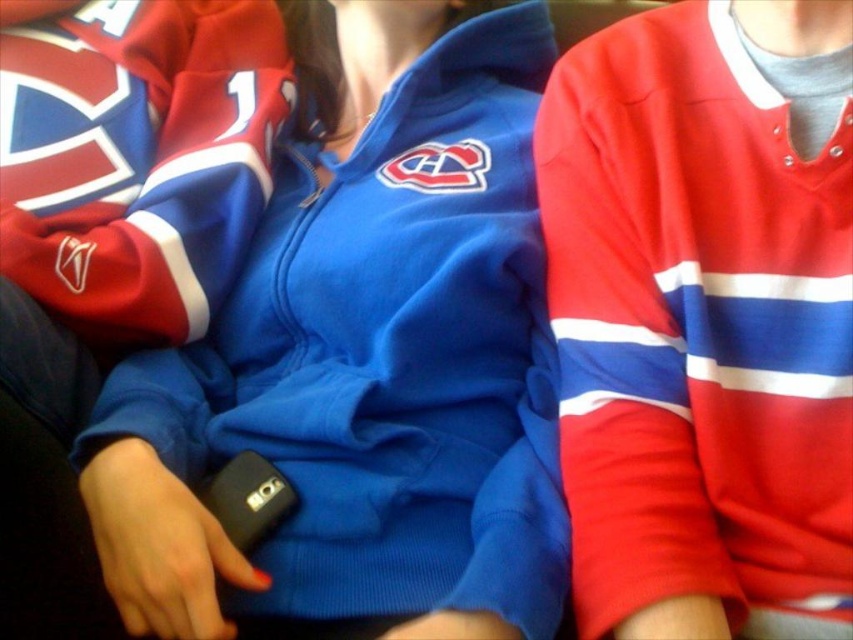
Does matte blue hoodie at center lie behind matte jersey at center?

Yes, it is behind matte jersey at center.

From the picture: Who is higher up, matte blue hoodie at center or matte jersey at center?

matte blue hoodie at center

Is point (347, 394) less distant than point (697, 545)?

No, (347, 394) is behind (697, 545).

Image resolution: width=853 pixels, height=640 pixels. I want to click on matte blue hoodie at center, so click(366, 362).